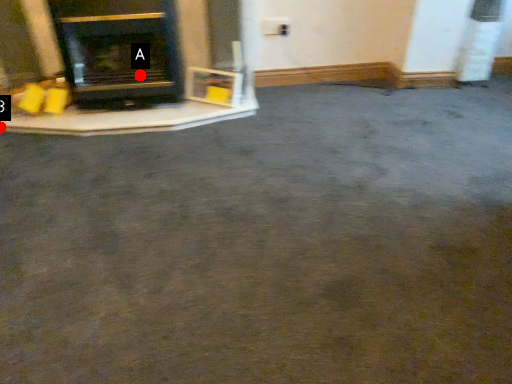
Question: Two points are circled on the image, labeled by A and B beside each circle. Which of the following is the farthest from the observer?

Choices:
 (A) A is further
 (B) B is further

Answer: (A)